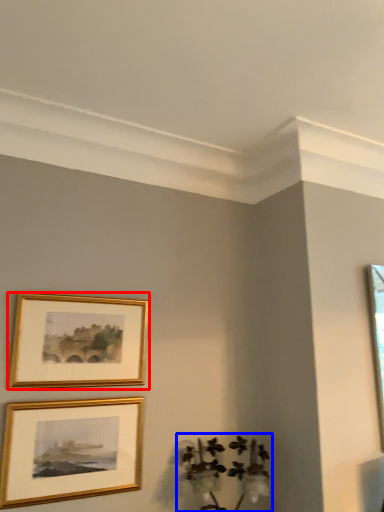
Question: Which object is further to the camera taking this photo, picture frame (highlighted by a red box) or plant (highlighted by a blue box)?

Choices:
 (A) picture frame
 (B) plant

Answer: (A)